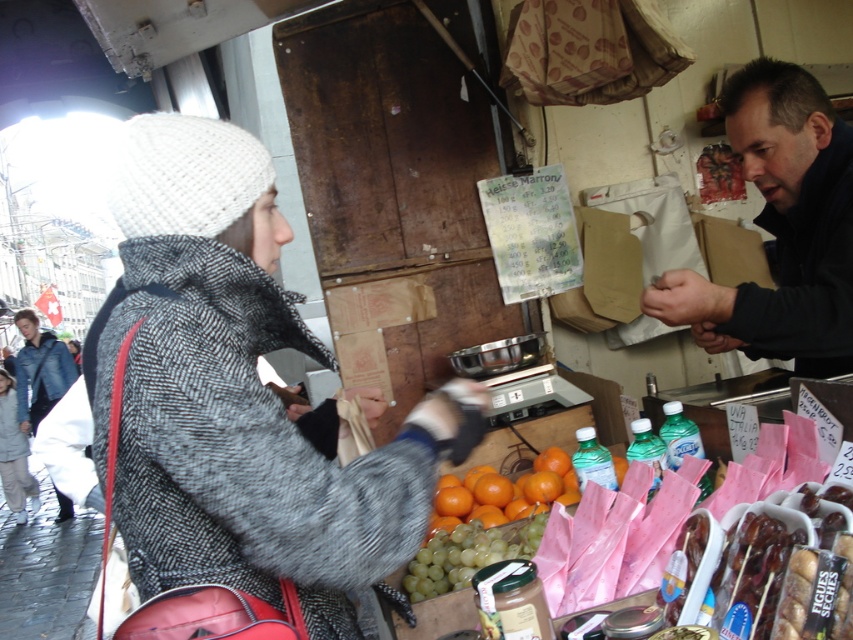
Between dark blue jacket at upper right and denim jacket at left, which one is positioned higher?

dark blue jacket at upper right

Which of these two, dark blue jacket at upper right or denim jacket at left, stands taller?

denim jacket at left

Is point (805, 209) less distant than point (42, 356)?

Yes.

Image resolution: width=853 pixels, height=640 pixels. What are the coordinates of `dark blue jacket at upper right` in the screenshot? It's located at (780, 228).

Is point (283, 342) farther from camera compared to point (32, 355)?

No, it is in front of (32, 355).

Between knitted wool hat at upper left and denim jacket at left, which one appears on the right side from the viewer's perspective?

From the viewer's perspective, knitted wool hat at upper left appears more on the right side.

Find the location of a particular element. This screenshot has height=640, width=853. knitted wool hat at upper left is located at coordinates (242, 396).

At what (x,y) coordinates should I click in order to perform the action: click on knitted wool hat at upper left. Please return your answer as a coordinate pair (x, y). Looking at the image, I should click on (242, 396).

Can you confirm if knitted wool hat at upper left is smaller than dark blue jacket at upper right?

Actually, knitted wool hat at upper left might be larger than dark blue jacket at upper right.

Is point (180, 451) positioned before point (672, 324)?

Yes, it is in front of point (672, 324).

This screenshot has width=853, height=640. I want to click on knitted wool hat at upper left, so click(242, 396).